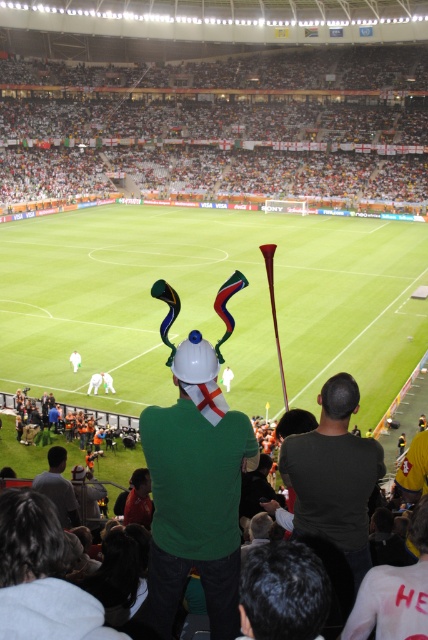
Question: Estimate the real-world distances between objects in this image. Which object is closer to the green matte helmet at center?

Choices:
 (A) gray fabric shirt at lower left
 (B) dark brown hair at center
 (C) white plastic flags at upper center
 (D) dark green shirt at center

Answer: (D)

Question: Which object appears closest to the camera in this image?

Choices:
 (A) green grass at center
 (B) dark green shirt at center
 (C) dark brown hair at center

Answer: (C)

Question: Is white plastic flags at upper center closer to the viewer compared to green matte helmet at center?

Choices:
 (A) no
 (B) yes

Answer: (A)

Question: Does dark green shirt at center appear over dark brown hair at center?

Choices:
 (A) yes
 (B) no

Answer: (A)

Question: Which object appears farthest from the camera in this image?

Choices:
 (A) white plastic flags at upper center
 (B) gray fabric shirt at lower left
 (C) dark brown hair at center
 (D) green grass at center

Answer: (A)

Question: Is dark green shirt at center below dark brown hair at center?

Choices:
 (A) yes
 (B) no

Answer: (B)